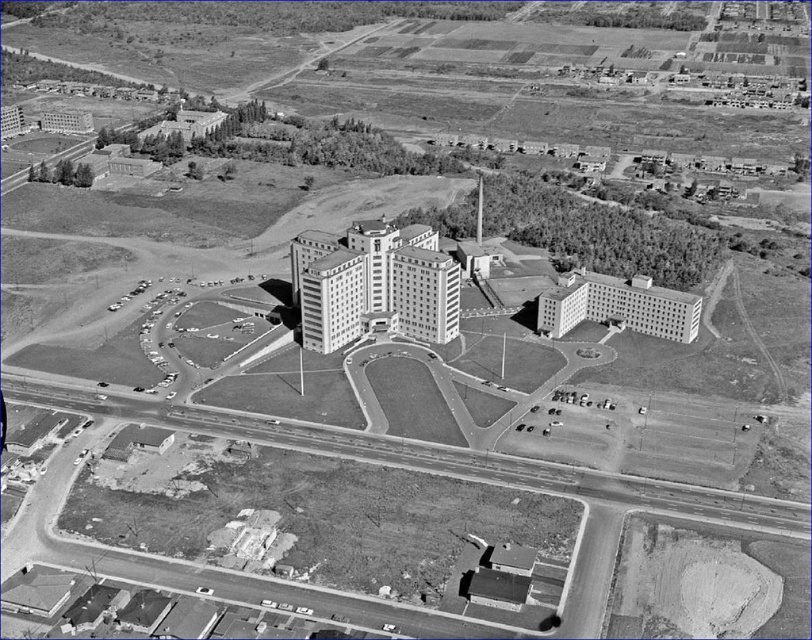
Question: Which object is closer to the camera taking this photo?

Choices:
 (A) smooth concrete building at center
 (B) smooth concrete building at center-right

Answer: (A)

Question: Which object is farther from the camera taking this photo?

Choices:
 (A) smooth concrete building at center-right
 (B) smooth concrete building at center

Answer: (A)

Question: Is smooth concrete building at center behind smooth concrete building at center-right?

Choices:
 (A) yes
 (B) no

Answer: (B)

Question: In this image, where is smooth concrete building at center located relative to smooth concrete building at center-right?

Choices:
 (A) above
 (B) below

Answer: (A)

Question: Is smooth concrete building at center thinner than smooth concrete building at center-right?

Choices:
 (A) yes
 (B) no

Answer: (B)